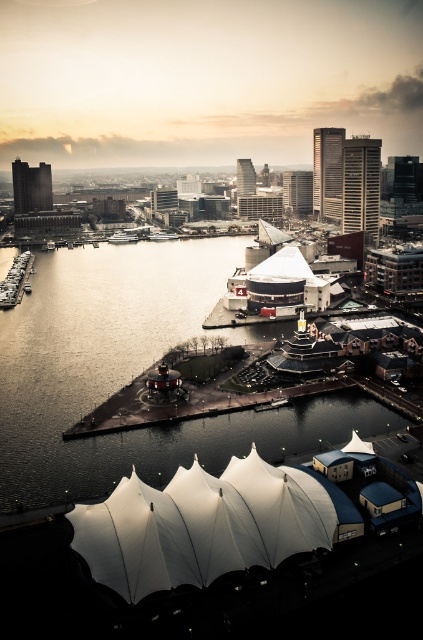
You are a drone operator tasked with capturing aerial footage of the cityscape. Your drone has a maximum flight range of 130 feet from your current position. You notice the silvery water at center and the curved roof building in the middle ground. Can your drone reach the curved roof building from your current position without exceeding its range?

The silvery water at center and the curved roof building in the middle ground are 136.10 feet apart. Since the drone has a maximum range of 130 feet, it cannot reach the curved roof building without exceeding its range.